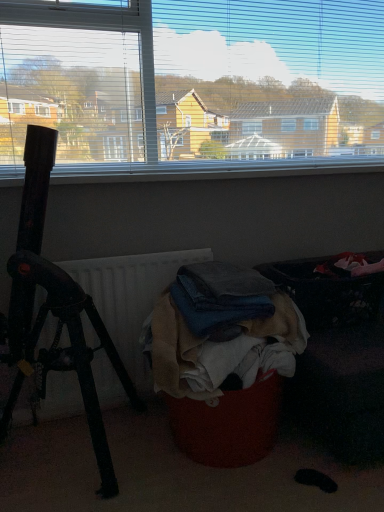
Measure the distance between point (352,309) and camera.

Point (352,309) and camera are 1.86 meters apart.

Measure the distance between denim fabric clothes at center and camera.

denim fabric clothes at center and camera are 1.53 meters apart.

This screenshot has height=512, width=384. Describe the element at coordinates (220, 331) in the screenshot. I see `denim fabric clothes at center` at that location.

I want to click on black matte tripod at left, so click(73, 349).

You are a GUI agent. You are given a task and a screenshot of the screen. Output one action in this format:
    pyautogui.click(x=<x>, y=<y>)
    Task: Click on the textured fabric laundry basket at lower right
    This screenshot has width=384, height=512.
    Given the screenshot: What is the action you would take?
    pyautogui.click(x=337, y=359)

Is dark fabric laundry basket at right inside white matte radiator at center?

Actually, dark fabric laundry basket at right is outside white matte radiator at center.

From a real-world perspective, is white matte radiator at center physically located above or below dark fabric laundry basket at right?

From a real-world perspective, white matte radiator at center is physically below dark fabric laundry basket at right.

From the image's perspective, is white matte radiator at center under dark fabric laundry basket at right?

Yes, from the image's perspective, white matte radiator at center is beneath dark fabric laundry basket at right.

Considering the sizes of white matte radiator at center and dark fabric laundry basket at right in the image, is white matte radiator at center wider or thinner than dark fabric laundry basket at right?

Considering their sizes, white matte radiator at center looks slimmer than dark fabric laundry basket at right.

Is textured fabric laundry basket at lower right located outside black matte tripod at left?

Indeed, textured fabric laundry basket at lower right is completely outside black matte tripod at left.

Can you see textured fabric laundry basket at lower right touching black matte tripod at left?

There is a gap between textured fabric laundry basket at lower right and black matte tripod at left.

From a real-world perspective, is textured fabric laundry basket at lower right positioned above or below black matte tripod at left?

textured fabric laundry basket at lower right is below black matte tripod at left.

Is black matte tripod at left at the back of textured fabric laundry basket at lower right?

No, textured fabric laundry basket at lower right is not facing the opposite direction of black matte tripod at left.

Is textured fabric laundry basket at lower right not close to dark fabric laundry basket at right?

Actually, textured fabric laundry basket at lower right and dark fabric laundry basket at right are a little close together.

Between textured fabric laundry basket at lower right and dark fabric laundry basket at right, which one has larger width?

Wider between the two is textured fabric laundry basket at lower right.

At what (x,y) coordinates should I click in order to perform the action: click on laundry basket behind the textured fabric laundry basket at lower right. Please return your answer as a coordinate pair (x, y). This screenshot has height=512, width=384. Looking at the image, I should click on (327, 292).

From the image's perspective, does textured fabric laundry basket at lower right appear lower than dark fabric laundry basket at right?

Indeed, from the image's perspective, textured fabric laundry basket at lower right is shown beneath dark fabric laundry basket at right.

From the image's perspective, relative to denim fabric clothes at center, is white matte radiator at center above or below?

Clearly, from the image's perspective, white matte radiator at center is below denim fabric clothes at center.

Does point (168, 280) appear closer or farther from the camera than point (214, 341)?

Clearly, point (168, 280) is more distant from the camera than point (214, 341).

Measure the distance between white matte radiator at center and denim fabric clothes at center.

white matte radiator at center is 17.41 inches away from denim fabric clothes at center.

Who is shorter, white matte radiator at center or denim fabric clothes at center?

Standing shorter between the two is denim fabric clothes at center.

Is black matte tripod at left looking in the opposite direction of denim fabric clothes at center?

black matte tripod at left is not turned away from denim fabric clothes at center.

Looking at this image, is black matte tripod at left directly adjacent to denim fabric clothes at center?

They are not placed beside each other.

Which object is closer to the camera taking this photo, black matte tripod at left or denim fabric clothes at center?

Positioned in front is black matte tripod at left.

Which is nearer, (24, 267) or (283, 359)?

Point (24, 267).

Is black matte tripod at left completely or partially outside of textured fabric laundry basket at lower right?

Yes, black matte tripod at left is located beyond the bounds of textured fabric laundry basket at lower right.

Locate an element on the screen. Image resolution: width=384 pixels, height=512 pixels. tripod above the textured fabric laundry basket at lower right (from the image's perspective) is located at coordinates (73, 349).

Considering the relative sizes of black matte tripod at left and textured fabric laundry basket at lower right in the image provided, is black matte tripod at left thinner than textured fabric laundry basket at lower right?

Indeed, black matte tripod at left has a lesser width compared to textured fabric laundry basket at lower right.

Considering the relative sizes of dark fabric laundry basket at right and denim fabric clothes at center in the image provided, is dark fabric laundry basket at right smaller than denim fabric clothes at center?

Yes.

Is dark fabric laundry basket at right not inside denim fabric clothes at center?

Yes, dark fabric laundry basket at right is located beyond the bounds of denim fabric clothes at center.

Which object is positioned more to the right, dark fabric laundry basket at right or denim fabric clothes at center?

From the viewer's perspective, dark fabric laundry basket at right appears more on the right side.

How many degrees apart are the facing directions of dark fabric laundry basket at right and denim fabric clothes at center?

The angular difference between dark fabric laundry basket at right and denim fabric clothes at center is 5.8 degrees.

The image size is (384, 512). What are the coordinates of `laundry basket above the white matte radiator at center (from a real-world perspective)` in the screenshot? It's located at (327, 292).

The width and height of the screenshot is (384, 512). In order to click on furniture that appears on the right of black matte tripod at left in this screenshot , I will do `click(337, 359)`.

Which object lies further to the anchor point denim fabric clothes at center, dark fabric laundry basket at right or textured fabric laundry basket at lower right?

The object further to denim fabric clothes at center is dark fabric laundry basket at right.

From the image, which object appears to be nearer to white matte radiator at center, black matte tripod at left or dark fabric laundry basket at right?

black matte tripod at left.

Based on their spatial positions, is white matte radiator at center or textured fabric laundry basket at lower right further from dark fabric laundry basket at right?

Based on the image, white matte radiator at center appears to be further to dark fabric laundry basket at right.

When comparing their distances from textured fabric laundry basket at lower right, does white matte radiator at center or denim fabric clothes at center seem further?

Based on the image, white matte radiator at center appears to be further to textured fabric laundry basket at lower right.

Based on their spatial positions, is white matte radiator at center or black matte tripod at left closer to textured fabric laundry basket at lower right?

Among the two, white matte radiator at center is located nearer to textured fabric laundry basket at lower right.

Based on their spatial positions, is black matte tripod at left or denim fabric clothes at center further from white matte radiator at center?

denim fabric clothes at center is positioned further to the anchor white matte radiator at center.

Estimate the real-world distances between objects in this image. Which object is closer to white matte radiator at center, dark fabric laundry basket at right or denim fabric clothes at center?

The object closer to white matte radiator at center is denim fabric clothes at center.

From the image, which object appears to be farther from textured fabric laundry basket at lower right, denim fabric clothes at center or black matte tripod at left?

Among the two, black matte tripod at left is located further to textured fabric laundry basket at lower right.

Where is `laundry basket between white matte radiator at center and textured fabric laundry basket at lower right`? laundry basket between white matte radiator at center and textured fabric laundry basket at lower right is located at coordinates (327, 292).

This screenshot has height=512, width=384. I want to click on clothing between white matte radiator at center and dark fabric laundry basket at right in the horizontal direction, so click(220, 331).

Identify the location of laundry basket between denim fabric clothes at center and textured fabric laundry basket at lower right in the horizontal direction. (327, 292).

Locate an element on the screen. clothing between black matte tripod at left and white matte radiator at center in the front-back direction is located at coordinates (220, 331).